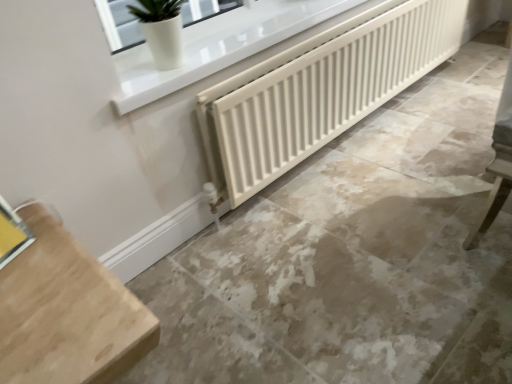
Find the location of `vacant space underneath white matte radiator at center (from a real-world perspective)`. vacant space underneath white matte radiator at center (from a real-world perspective) is located at coordinates (390, 109).